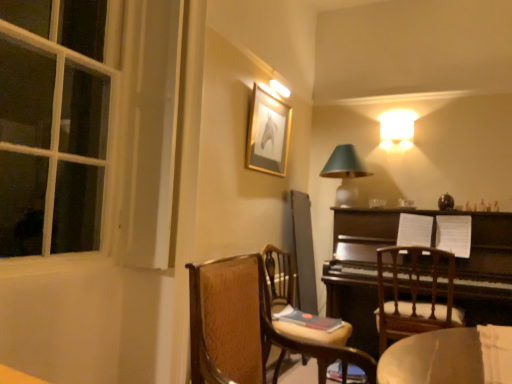
Question: From the image's perspective, is wooden chair at center, placed as the 3th chair when sorted from back to front, on gold-framed picture at upper center?

Choices:
 (A) no
 (B) yes

Answer: (A)

Question: From the image's perspective, is wooden chair at center, placed as the 1th chair when sorted from front to back, beneath gold-framed picture at upper center?

Choices:
 (A) no
 (B) yes

Answer: (B)

Question: Is wooden chair at center, placed as the 3th chair when sorted from back to front, next to gold-framed picture at upper center and touching it?

Choices:
 (A) yes
 (B) no

Answer: (B)

Question: From a real-world perspective, is wooden chair at center, placed as the 3th chair when sorted from back to front, beneath gold-framed picture at upper center?

Choices:
 (A) no
 (B) yes

Answer: (B)

Question: Considering the relative sizes of wooden chair at center, placed as the 1th chair when sorted from front to back, and gold-framed picture at upper center in the image provided, is wooden chair at center, placed as the 1th chair when sorted from front to back, taller than gold-framed picture at upper center?

Choices:
 (A) no
 (B) yes

Answer: (A)

Question: Visually, is wooden chair at center, the 2th chair when ordered from back to front, positioned to the left or to the right of gold-framed picture at upper center?

Choices:
 (A) right
 (B) left

Answer: (A)

Question: From a real-world perspective, is wooden chair at center, the 2th chair when ordered from back to front, above or below gold-framed picture at upper center?

Choices:
 (A) above
 (B) below

Answer: (B)

Question: Is point (264, 253) positioned closer to the camera than point (265, 127)?

Choices:
 (A) farther
 (B) closer

Answer: (B)

Question: Do you think wooden chair at center, the 2th chair when ordered from back to front, is within gold-framed picture at upper center, or outside of it?

Choices:
 (A) outside
 (B) inside

Answer: (A)

Question: Considering the positions of wooden chair at center, placed as the 3th chair when sorted from back to front, and matte green glass table lamp at upper right in the image, is wooden chair at center, placed as the 3th chair when sorted from back to front, taller or shorter than matte green glass table lamp at upper right?

Choices:
 (A) tall
 (B) short

Answer: (B)

Question: Looking at the image, does wooden chair at center, placed as the 3th chair when sorted from back to front, seem bigger or smaller compared to matte green glass table lamp at upper right?

Choices:
 (A) big
 (B) small

Answer: (A)

Question: Visually, is wooden chair at center, placed as the 1th chair when sorted from front to back, positioned to the left or to the right of matte green glass table lamp at upper right?

Choices:
 (A) right
 (B) left

Answer: (B)

Question: Is wooden chair at center, placed as the 3th chair when sorted from back to front, inside the boundaries of matte green glass table lamp at upper right, or outside?

Choices:
 (A) outside
 (B) inside

Answer: (A)

Question: Do you think dark brown polished wood piano at right is within wooden chair at center, the 2th chair viewed from the front, or outside of it?

Choices:
 (A) inside
 (B) outside

Answer: (B)

Question: In terms of size, does dark brown polished wood piano at right appear bigger or smaller than wooden chair at center, the 2th chair when ordered from back to front?

Choices:
 (A) small
 (B) big

Answer: (B)